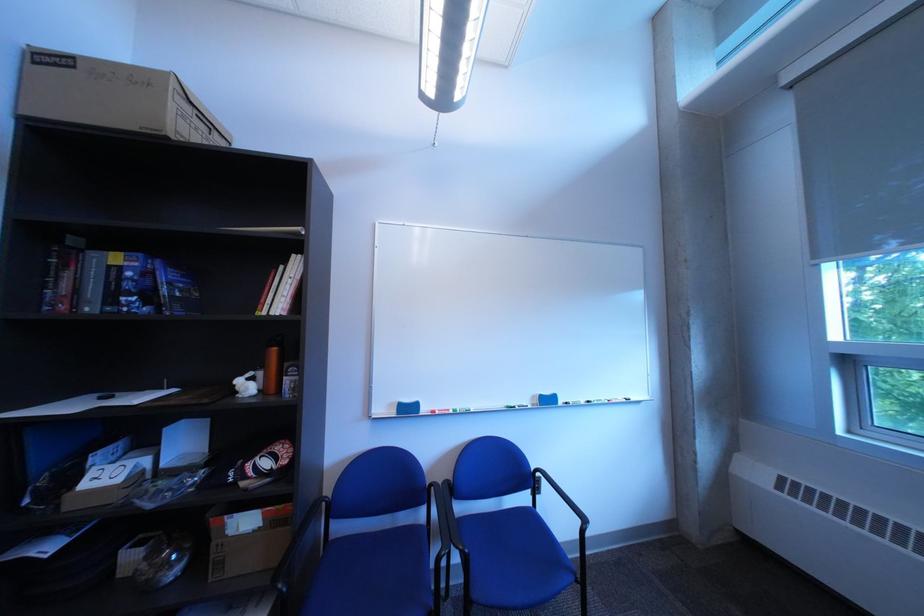
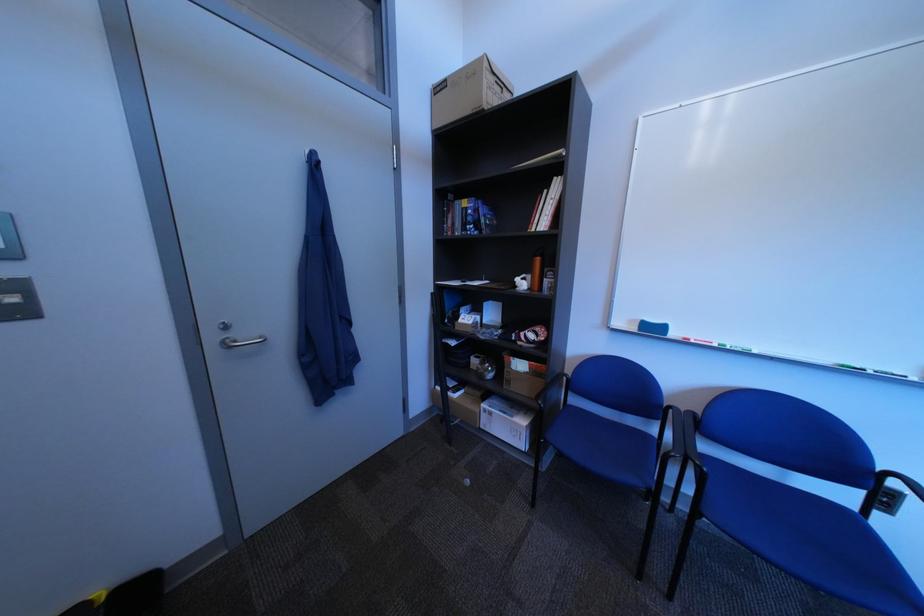
Where in the second image is the point corresponding to (237,565) from the first image?

(525, 383)